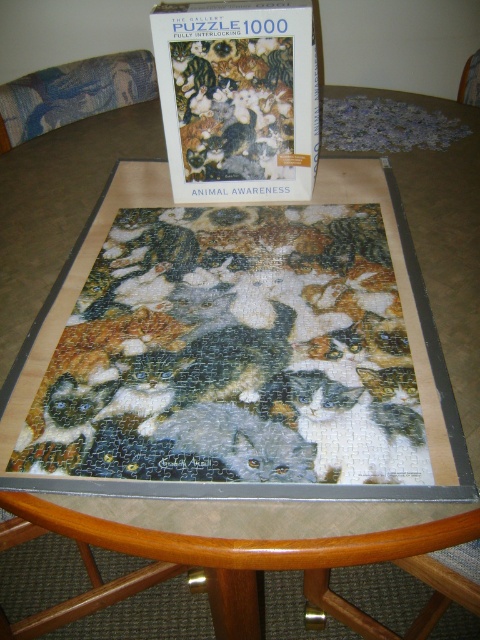
Locate an element on the screen. The image size is (480, 640). multicolored paper puzzle at center is located at coordinates (231, 355).

Does multicolored paper puzzle at center come in front of matte cardboard puzzle box at upper center?

Yes.

Is point (127, 344) positioned in front of point (303, 1)?

That is True.

Image resolution: width=480 pixels, height=640 pixels. In order to click on multicolored paper puzzle at center in this screenshot , I will do `click(231, 355)`.